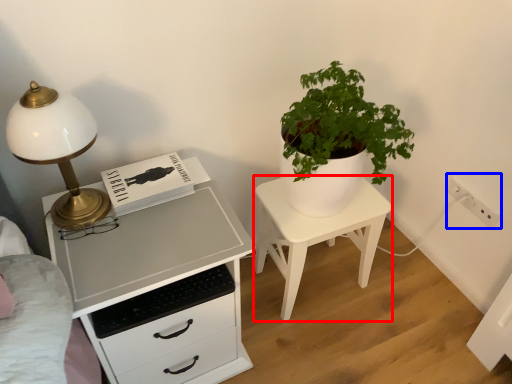
Question: Which of the following is the farthest to the observer, nightstand (highlighted by a red box) or electric outlet (highlighted by a blue box)?

Choices:
 (A) nightstand
 (B) electric outlet

Answer: (B)